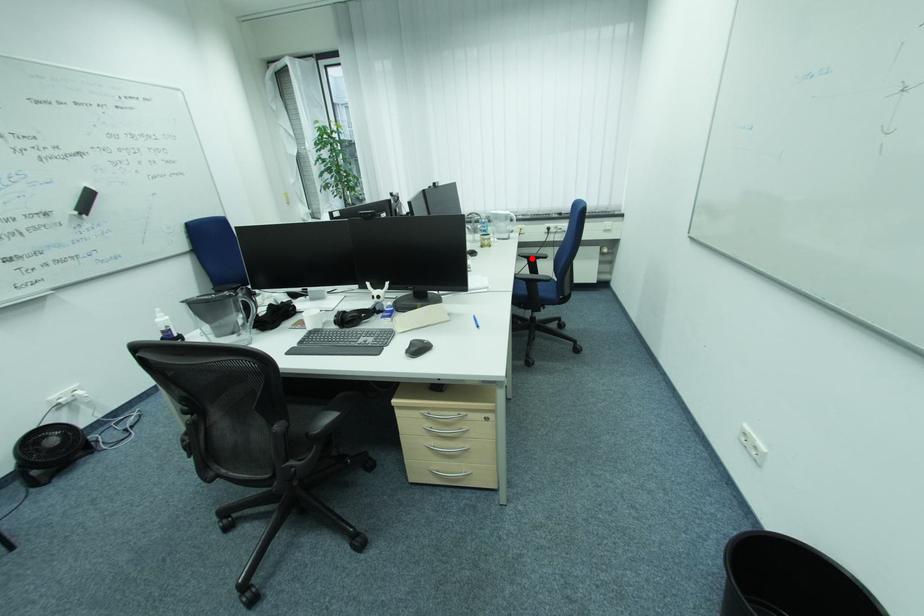
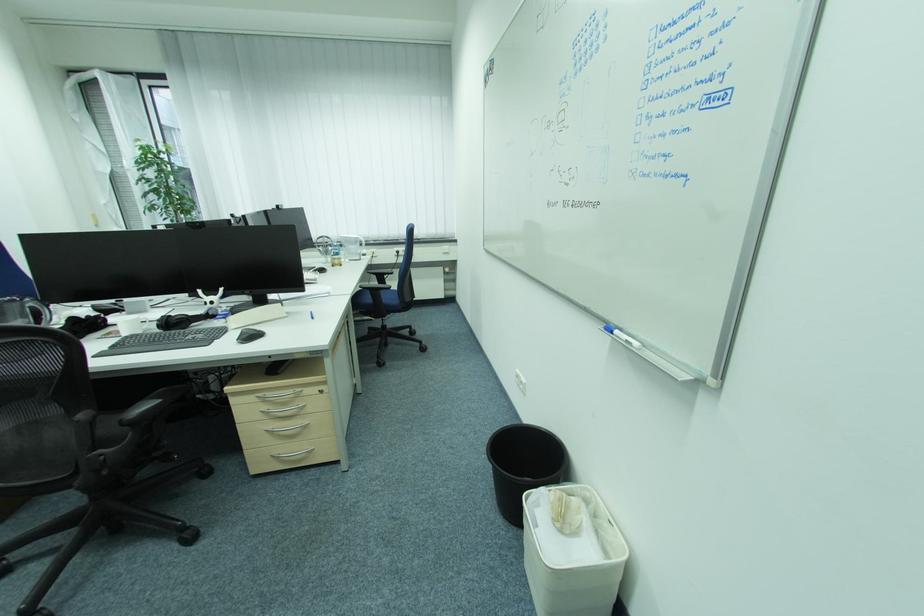
Locate, in the second image, the point that corresponds to the highlighted location in the first image.

(381, 275)